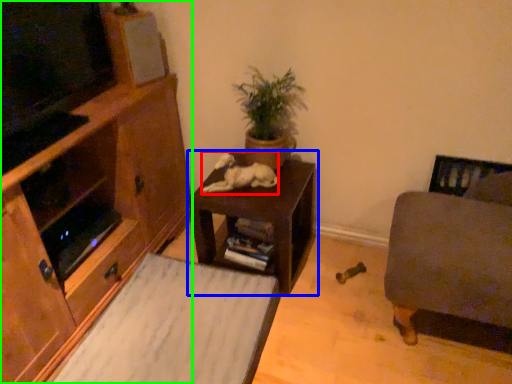
Question: Estimate the real-world distances between objects in this image. Which object is farther from animal (highlighted by a red box), table (highlighted by a blue box) or cabinetry (highlighted by a green box)?

Choices:
 (A) table
 (B) cabinetry

Answer: (B)